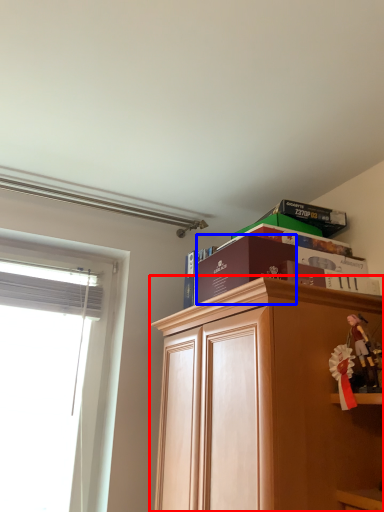
Question: Among these objects, which one is farthest to the camera, cabinetry (highlighted by a red box) or paperback book (highlighted by a blue box)?

Choices:
 (A) cabinetry
 (B) paperback book

Answer: (B)